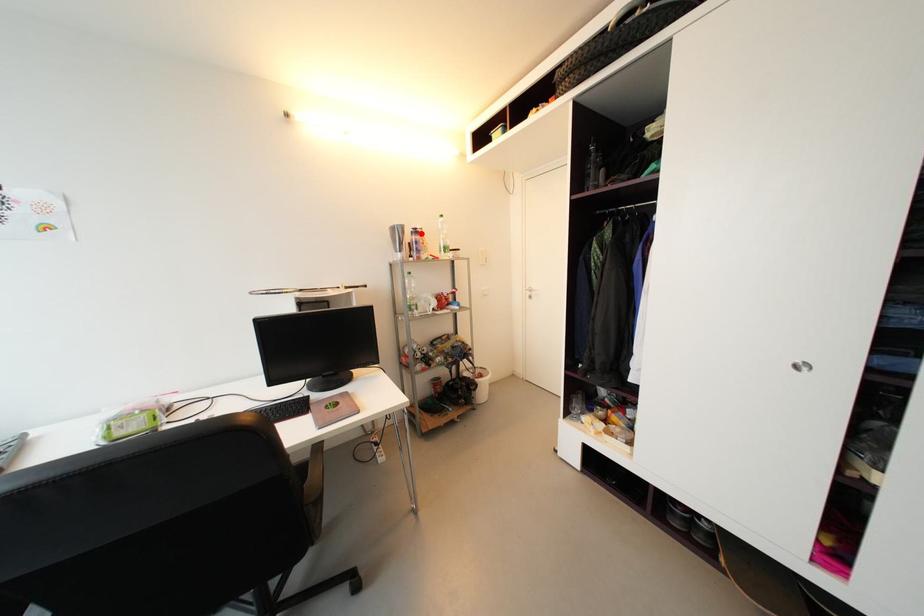
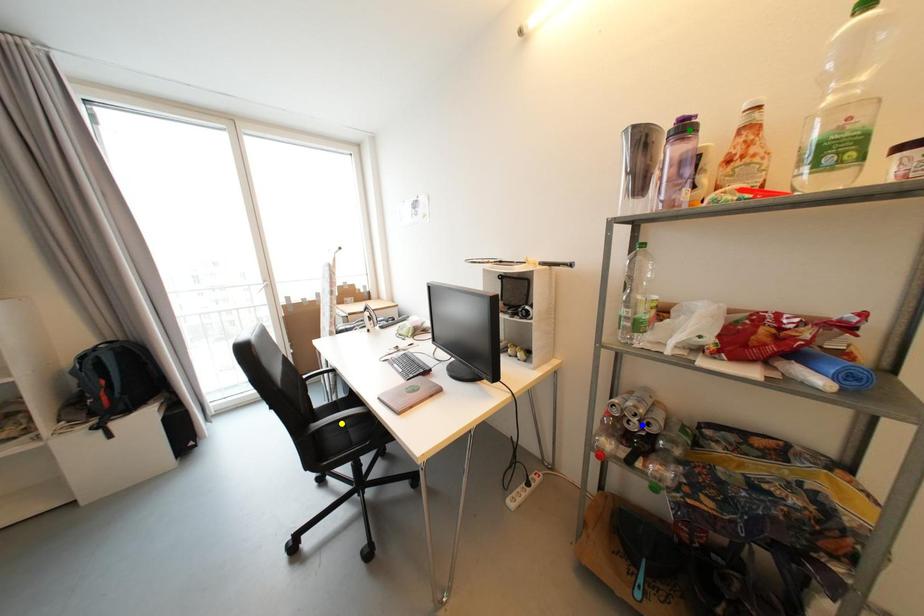
Question: I am providing you with two images of the same scene from different viewpoints. A red point is marked on the first image. You are given multiple points on the second image. Which point in image 2 represents the same 3d spot as the red point in image 1?

Choices:
 (A) yellow point
 (B) green point
 (C) blue point

Answer: (B)